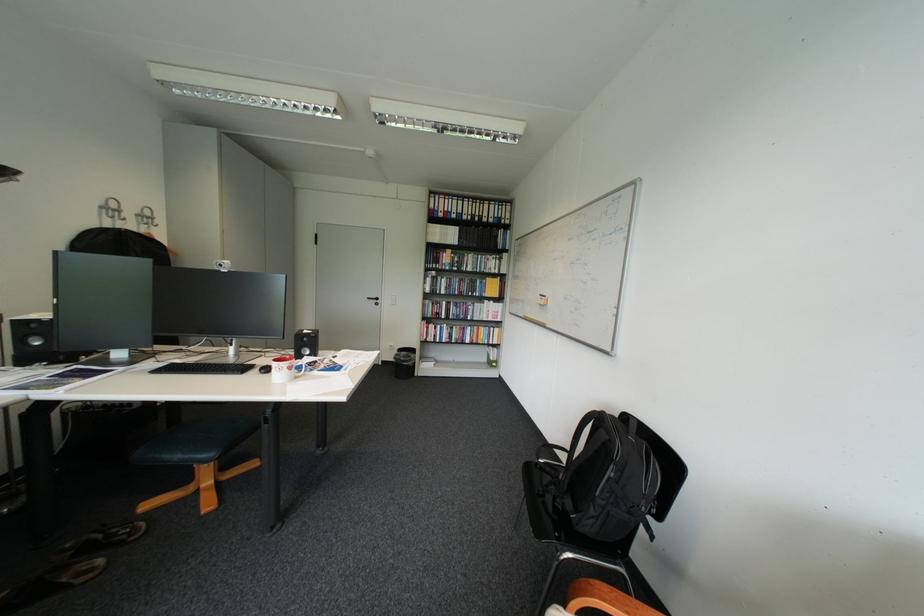
The location [371,153] corresponds to which object?

It refers to a white webcam.